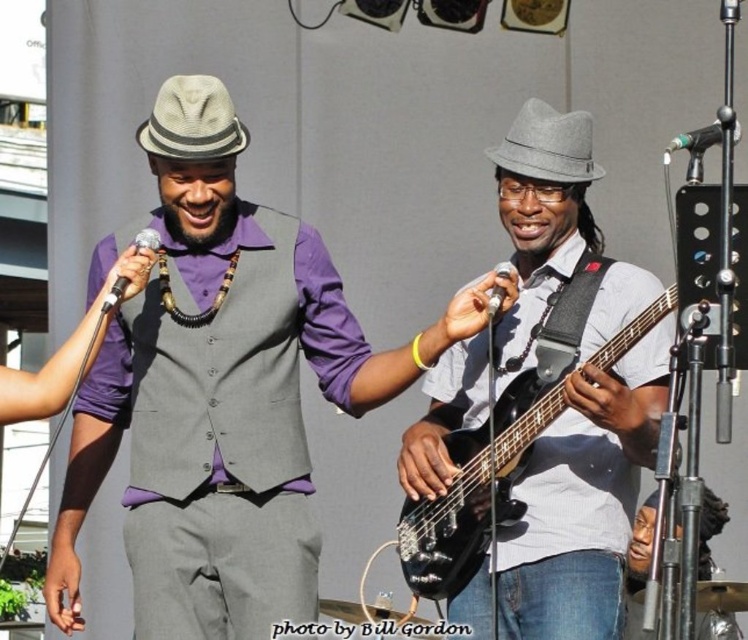
Is point (557, 134) closer to viewer compared to point (506, 275)?

No, (557, 134) is further to viewer.

Between matte black bass guitar at center and metallic silver microphone at center, which one has more height?

matte black bass guitar at center is taller.

Does point (625, 289) come farther from viewer compared to point (491, 301)?

Yes, it is behind point (491, 301).

I want to click on matte black bass guitar at center, so click(586, 481).

What do you see at coordinates (218, 454) in the screenshot? I see `matte gray vest at center` at bounding box center [218, 454].

Does matte gray vest at center appear under matte black bass guitar at center?

Yes, matte gray vest at center is below matte black bass guitar at center.

Locate an element on the screen. This screenshot has width=748, height=640. matte gray vest at center is located at coordinates (218, 454).

Where is `matte gray vest at center`? This screenshot has height=640, width=748. matte gray vest at center is located at coordinates (218, 454).

Does matte gray vest at center have a lesser width compared to metallic silver microphone at upper right?

Incorrect, matte gray vest at center's width is not less than metallic silver microphone at upper right's.

Which is more to the left, matte gray vest at center or metallic silver microphone at upper right?

Positioned to the left is matte gray vest at center.

I want to click on matte gray vest at center, so click(218, 454).